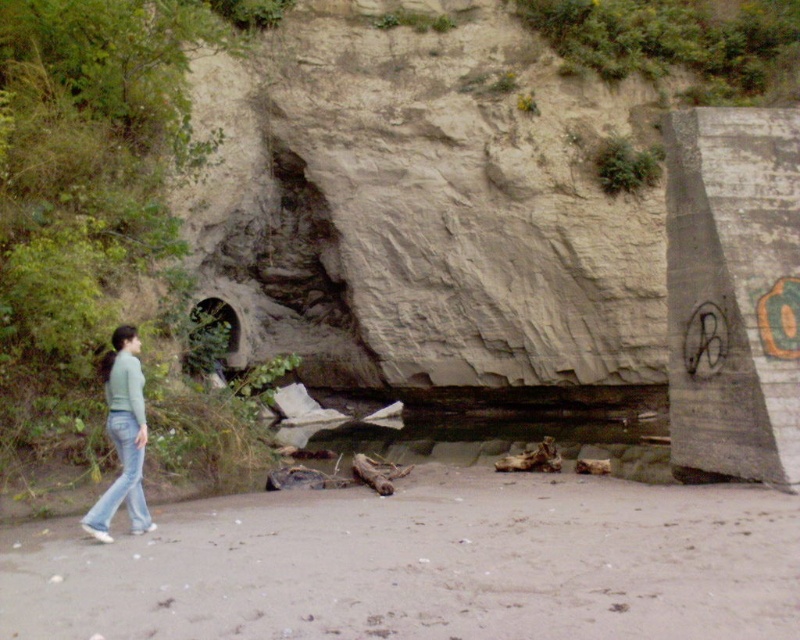
Is point (424, 467) behind point (113, 488)?

Yes, it is.

Can you confirm if brown sand at lower center is positioned above blue denim jeans at lower left?

No.

Which is in front, point (302, 529) or point (112, 490)?

Point (112, 490) is more forward.

Locate an element on the screen. This screenshot has height=640, width=800. brown sand at lower center is located at coordinates (424, 564).